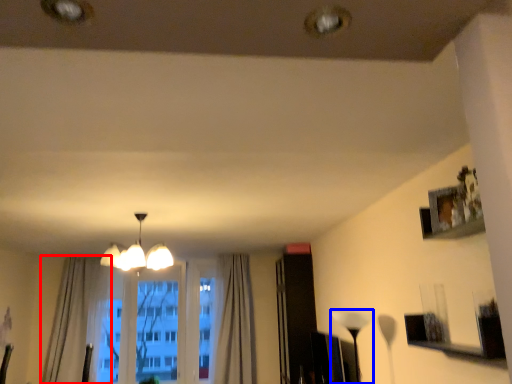
Question: Which of the following is the farthest to the observer, curtain (highlighted by a red box) or lamp (highlighted by a blue box)?

Choices:
 (A) curtain
 (B) lamp

Answer: (A)